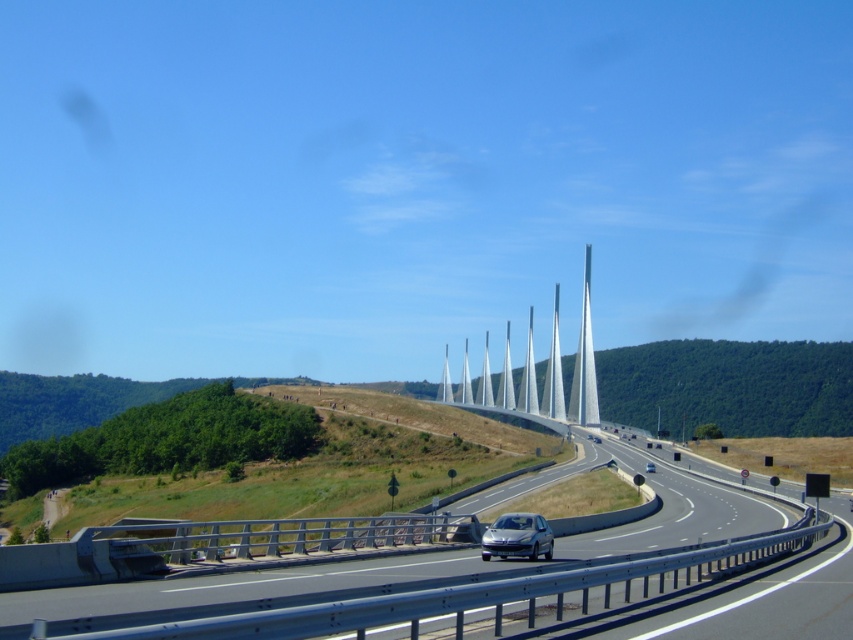
Does satin silver car at center have a larger size compared to silver metallic car at center?

Indeed, satin silver car at center has a larger size compared to silver metallic car at center.

Is point (486, 529) positioned before point (653, 468)?

Yes, point (486, 529) is closer to viewer.

Where is `satin silver car at center`? The image size is (853, 640). satin silver car at center is located at coordinates (517, 536).

Does gray asphalt highway at center appear on the left side of silver metallic car at center?

Yes, gray asphalt highway at center is to the left of silver metallic car at center.

Between gray asphalt highway at center and silver metallic car at center, which one appears on the left side from the viewer's perspective?

gray asphalt highway at center

Is point (213, 596) positioned in front of point (650, 467)?

Yes, point (213, 596) is in front of point (650, 467).

Find the location of a particular element. This screenshot has width=853, height=640. gray asphalt highway at center is located at coordinates (393, 564).

Who is higher up, gray asphalt highway at center or satin silver car at center?

Positioned higher is satin silver car at center.

Can you confirm if gray asphalt highway at center is positioned to the left of satin silver car at center?

Incorrect, gray asphalt highway at center is not on the left side of satin silver car at center.

Between point (518, 580) and point (514, 536), which one is positioned in front?

Positioned in front is point (518, 580).

I want to click on gray asphalt highway at center, so click(393, 564).